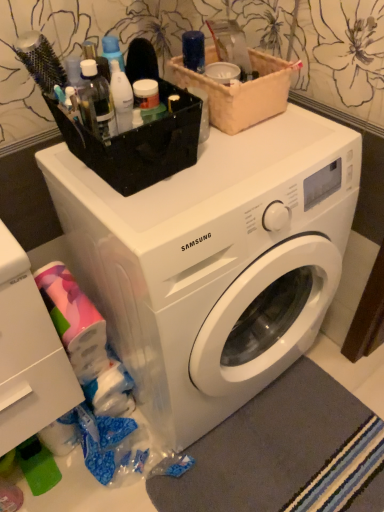
Question: From a real-world perspective, is gray soft rug at lower right beneath beige fabric basket at upper center?

Choices:
 (A) no
 (B) yes

Answer: (B)

Question: Is gray soft rug at lower right next to beige fabric basket at upper center?

Choices:
 (A) yes
 (B) no

Answer: (B)

Question: Does gray soft rug at lower right have a lesser height compared to beige fabric basket at upper center?

Choices:
 (A) no
 (B) yes

Answer: (B)

Question: Does gray soft rug at lower right have a lesser width compared to beige fabric basket at upper center?

Choices:
 (A) no
 (B) yes

Answer: (A)

Question: Can you confirm if gray soft rug at lower right is bigger than beige fabric basket at upper center?

Choices:
 (A) yes
 (B) no

Answer: (B)

Question: Is beige fabric basket at upper center inside gray soft rug at lower right?

Choices:
 (A) no
 (B) yes

Answer: (A)

Question: Does white plastic washing machine at center turn towards white plastic drawer at lower left?

Choices:
 (A) yes
 (B) no

Answer: (B)

Question: Considering the relative sizes of white plastic washing machine at center and white plastic drawer at lower left in the image provided, is white plastic washing machine at center smaller than white plastic drawer at lower left?

Choices:
 (A) yes
 (B) no

Answer: (B)

Question: Is white plastic washing machine at center far from white plastic drawer at lower left?

Choices:
 (A) no
 (B) yes

Answer: (A)

Question: Considering the relative sizes of white plastic washing machine at center and white plastic drawer at lower left in the image provided, is white plastic washing machine at center shorter than white plastic drawer at lower left?

Choices:
 (A) no
 (B) yes

Answer: (A)

Question: Is white plastic washing machine at center at the left side of white plastic drawer at lower left?

Choices:
 (A) yes
 (B) no

Answer: (B)

Question: From a real-world perspective, is white plastic washing machine at center positioned under white plastic drawer at lower left based on gravity?

Choices:
 (A) yes
 (B) no

Answer: (A)

Question: Is gray soft rug at lower right bigger than white plastic washing machine at center?

Choices:
 (A) yes
 (B) no

Answer: (B)